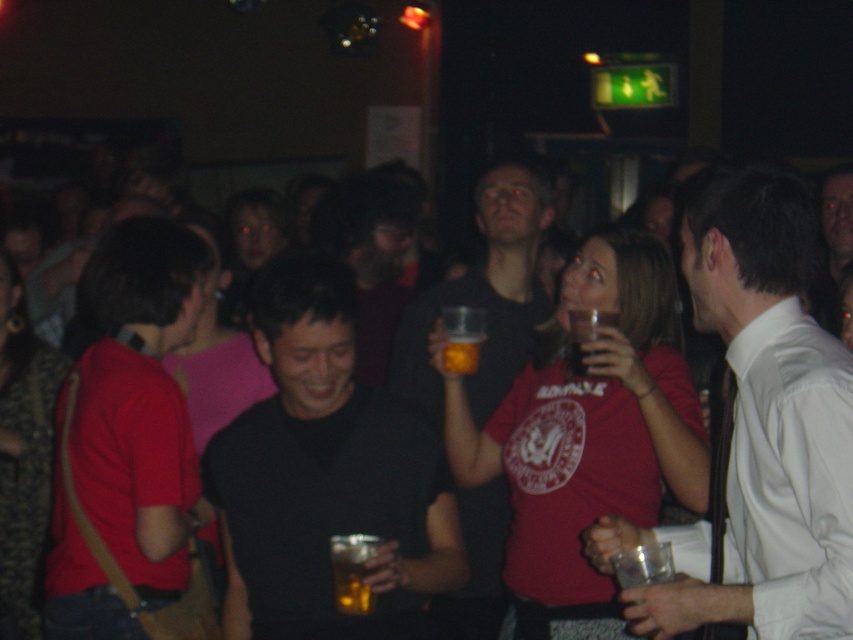
You are standing in the bar scene and want to move towards the two points marked in the image. Which point, point [734,465] or point [445,348], would you reach first?

You would reach point [734,465] first because it is closer to you than point [445,348].

In the scene shown: You are at a crowded event and need to pass between the black matte shirt at center and the matte black shirt at center. Which direction should you move to ensure you have enough space?

The black matte shirt at center is wider than the matte black shirt at center, so moving towards the matte black shirt at center would provide more space to pass through.

You are at a bar and see a white shirt at center and a translucent glass beer at center. Which object is positioned more to the right?

The white shirt at center is positioned more to the right than the translucent glass beer at center.